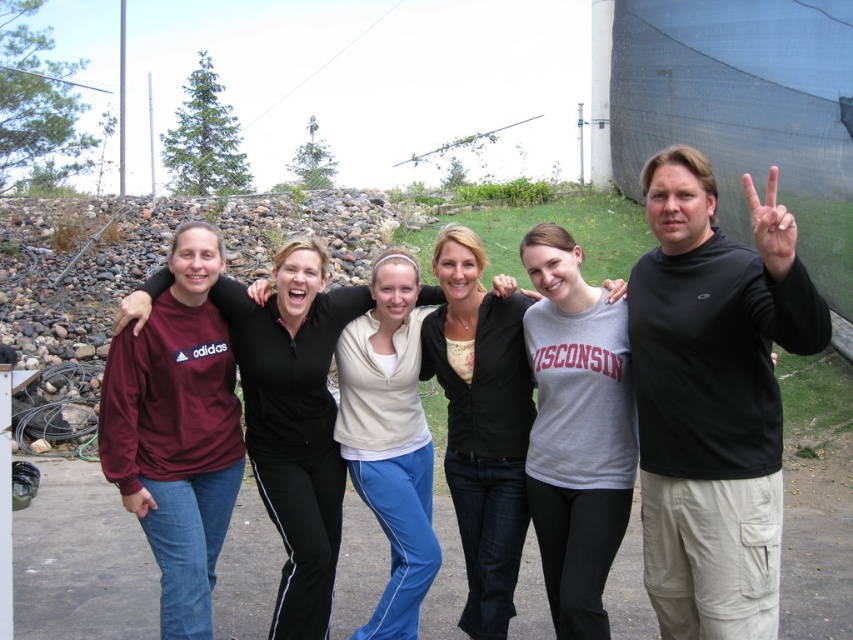
Which of these two, black turtleneck shirt at center or gray cotton hoodie at center, stands shorter?

With less height is gray cotton hoodie at center.

You are a GUI agent. You are given a task and a screenshot of the screen. Output one action in this format:
    pyautogui.click(x=<x>, y=<y>)
    Task: Click on the black turtleneck shirt at center
    This screenshot has height=640, width=853.
    Given the screenshot: What is the action you would take?
    pyautogui.click(x=712, y=397)

The image size is (853, 640). What are the coordinates of `black turtleneck shirt at center` in the screenshot? It's located at (712, 397).

Is maroon fleece at left shorter than gray cotton hoodie at center?

Incorrect, maroon fleece at left's height does not fall short of gray cotton hoodie at center's.

You are a GUI agent. You are given a task and a screenshot of the screen. Output one action in this format:
    pyautogui.click(x=<x>, y=<y>)
    Task: Click on the maroon fleece at left
    
    Given the screenshot: What is the action you would take?
    pyautogui.click(x=294, y=420)

Between gray cotton hoodie at center and black matte hand at upper right, which one has more height?

Standing taller between the two is gray cotton hoodie at center.

Between point (505, 593) and point (772, 180), which one is positioned in front?

Point (772, 180) is more forward.

Where is `gray cotton hoodie at center`? gray cotton hoodie at center is located at coordinates (480, 422).